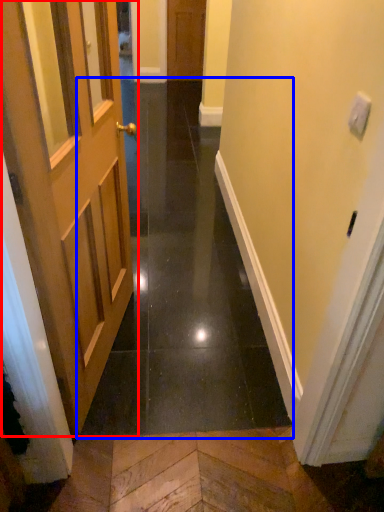
Question: Which of the following is the closest to the observer, door (highlighted by a red box) or path (highlighted by a blue box)?

Choices:
 (A) door
 (B) path

Answer: (A)